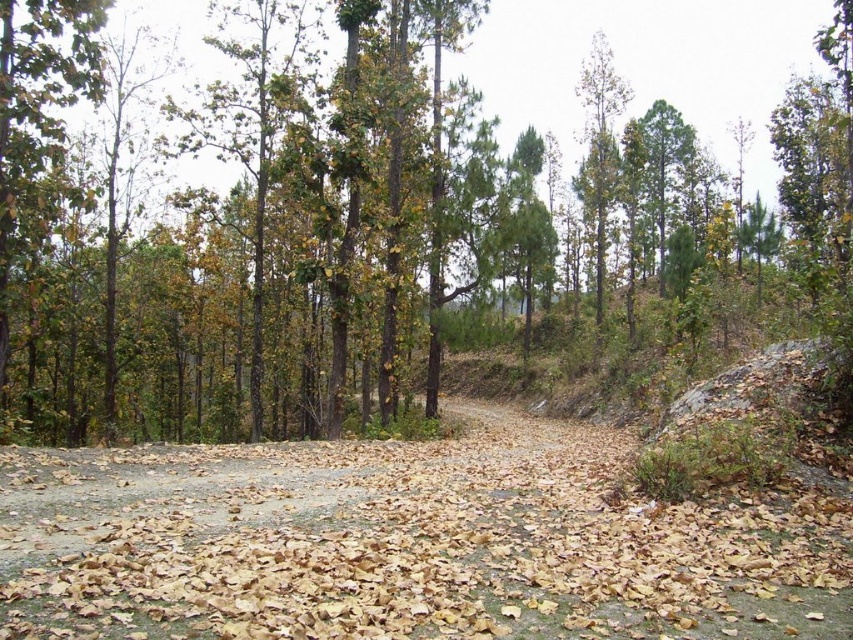
Can you confirm if brown matte tree at center is thinner than brown dirt track at center?

No.

In the scene shown: Who is shorter, brown matte tree at center or brown dirt track at center?

With less height is brown dirt track at center.

Does point (463, 4) come farther from viewer compared to point (273, 548)?

Yes.

The width and height of the screenshot is (853, 640). What are the coordinates of `brown matte tree at center` in the screenshot? It's located at tap(306, 221).